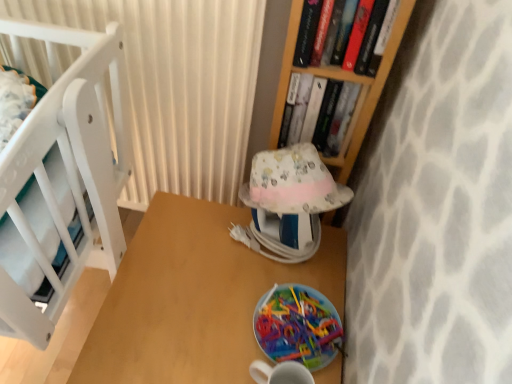
Describe the element at coordinates (177, 86) in the screenshot. I see `white textured curtain at upper left` at that location.

Where is `patterned fabric lampshade at center`? This screenshot has width=512, height=384. patterned fabric lampshade at center is located at coordinates (288, 202).

The height and width of the screenshot is (384, 512). Describe the element at coordinates (298, 326) in the screenshot. I see `translucent plastic plate at lower center` at that location.

I want to click on hardcover book at upper right, which appears as the 1th book when viewed from the front, so (365, 37).

Which point is more forward, (x=329, y=244) or (x=316, y=310)?

The point (x=316, y=310) is closer to the camera.

Locate an element on the screen. The height and width of the screenshot is (384, 512). table in front of the translucent plastic plate at lower center is located at coordinates (193, 298).

Is wooden table at center far from translucent plastic plate at lower center?

No.

From a real-world perspective, who is located higher, wooden table at center or translucent plastic plate at lower center?

From a 3D spatial view, translucent plastic plate at lower center is above.

Is patterned fabric lampshade at center located outside hardcover book at upper center, the first book positioned from the back?

Yes, patterned fabric lampshade at center is not within hardcover book at upper center, the first book positioned from the back.

Based on the photo, does patterned fabric lampshade at center lie in front of hardcover book at upper center, the first book positioned from the back?

That is True.

From a real-world perspective, is patterned fabric lampshade at center physically located above or below hardcover book at upper center, the first book positioned from the back?

patterned fabric lampshade at center is situated lower than hardcover book at upper center, the first book positioned from the back, in the real world.

Is patterned fabric lampshade at center not close to hardcover book at upper center, arranged as the 2th book when viewed from the front?

No, patterned fabric lampshade at center is not far from hardcover book at upper center, arranged as the 2th book when viewed from the front.

Is hardcover book at upper right, the second book in the back-to-front sequence, positioned with its back to patterned fabric lampshade at center?

That's not correct — hardcover book at upper right, the second book in the back-to-front sequence, is not looking away from patterned fabric lampshade at center.

This screenshot has height=384, width=512. What are the coordinates of `table lamp below the hardcover book at upper right, which appears as the 1th book when viewed from the front (from the image's perspective)` in the screenshot? It's located at (288, 202).

From the image's perspective, which is above, hardcover book at upper right, the second book in the back-to-front sequence, or patterned fabric lampshade at center?

hardcover book at upper right, the second book in the back-to-front sequence, is shown above in the image.

Is hardcover book at upper right, the second book in the back-to-front sequence, in front of or behind patterned fabric lampshade at center in the image?

In the image, hardcover book at upper right, the second book in the back-to-front sequence, appears in front of patterned fabric lampshade at center.

Does hardcover book at upper center, arranged as the 2th book when viewed from the front, have a greater width compared to wooden table at center?

No, hardcover book at upper center, arranged as the 2th book when viewed from the front, is not wider than wooden table at center.

Is hardcover book at upper center, the first book positioned from the back, in front of wooden table at center?

No, hardcover book at upper center, the first book positioned from the back, is further to the viewer.

How much distance is there between hardcover book at upper center, arranged as the 2th book when viewed from the front, and wooden table at center?

hardcover book at upper center, arranged as the 2th book when viewed from the front, and wooden table at center are 15.10 inches apart from each other.

How different are the orientations of hardcover book at upper center, arranged as the 2th book when viewed from the front, and wooden table at center in degrees?

hardcover book at upper center, arranged as the 2th book when viewed from the front, and wooden table at center are facing 85.5 degrees away from each other.

You are a GUI agent. You are given a task and a screenshot of the screen. Output one action in this format:
    pyautogui.click(x=<x>, y=<y>)
    Task: Click on the table below the translucent plastic plate at lower center (from the image's perspective)
    This screenshot has width=512, height=384.
    Given the screenshot: What is the action you would take?
    pyautogui.click(x=193, y=298)

From a real-world perspective, is translucent plastic plate at lower center over wooden table at center?

Yes, from a real-world perspective, translucent plastic plate at lower center is over wooden table at center

You are a GUI agent. You are given a task and a screenshot of the screen. Output one action in this format:
    pyautogui.click(x=<x>, y=<y>)
    Task: Click on the 1st book to the right when counting from the wooden table at center
    
    Given the screenshot: What is the action you would take?
    pyautogui.click(x=325, y=113)

Choose the correct answer: Is wooden table at center inside hardcover book at upper center, arranged as the 2th book when viewed from the front, or outside it?

wooden table at center is located beyond the bounds of hardcover book at upper center, arranged as the 2th book when viewed from the front.

Visually, is wooden table at center positioned to the left or to the right of hardcover book at upper center, arranged as the 2th book when viewed from the front?

In the image, wooden table at center appears on the left side of hardcover book at upper center, arranged as the 2th book when viewed from the front.

Can you confirm if wooden table at center is shorter than hardcover book at upper center, arranged as the 2th book when viewed from the front?

In fact, wooden table at center may be taller than hardcover book at upper center, arranged as the 2th book when viewed from the front.

Looking at this image, is hardcover book at upper center, the first book positioned from the back, taller or shorter than hardcover book at upper right, the second book in the back-to-front sequence?

hardcover book at upper center, the first book positioned from the back, is shorter than hardcover book at upper right, the second book in the back-to-front sequence.

I want to click on book on the right of the hardcover book at upper center, arranged as the 2th book when viewed from the front, so click(365, 37).

How different are the orientations of hardcover book at upper center, the first book positioned from the back, and hardcover book at upper right, which appears as the 1th book when viewed from the front, in degrees?

hardcover book at upper center, the first book positioned from the back, and hardcover book at upper right, which appears as the 1th book when viewed from the front, are facing 0.0033 degrees away from each other.

Is hardcover book at upper center, the first book positioned from the back, spatially inside hardcover book at upper right, which appears as the 1th book when viewed from the front, or outside of it?

hardcover book at upper center, the first book positioned from the back, exists outside the volume of hardcover book at upper right, which appears as the 1th book when viewed from the front.

Where is `plate on the right of wooden table at center`? This screenshot has height=384, width=512. plate on the right of wooden table at center is located at coordinates (298, 326).

The width and height of the screenshot is (512, 384). I want to click on table lamp beneath the hardcover book at upper center, the first book positioned from the back (from a real-world perspective), so click(x=288, y=202).

When comparing their distances from hardcover book at upper right, the second book in the back-to-front sequence, does patterned fabric lampshade at center or hardcover book at upper center, arranged as the 2th book when viewed from the front, seem further?

patterned fabric lampshade at center.

Looking at the image, which one is located further to wooden table at center, patterned fabric lampshade at center or hardcover book at upper center, arranged as the 2th book when viewed from the front?

hardcover book at upper center, arranged as the 2th book when viewed from the front, is further to wooden table at center.

Estimate the real-world distances between objects in this image. Which object is closer to wooden table at center, hardcover book at upper right, which appears as the 1th book when viewed from the front, or hardcover book at upper center, the first book positioned from the back?

hardcover book at upper center, the first book positioned from the back, is closer to wooden table at center.

Which object lies further to the anchor point translucent plastic plate at lower center, hardcover book at upper center, the first book positioned from the back, or wooden table at center?

Among the two, hardcover book at upper center, the first book positioned from the back, is located further to translucent plastic plate at lower center.

Which object lies further to the anchor point patterned fabric lampshade at center, hardcover book at upper right, the second book in the back-to-front sequence, or white textured curtain at upper left?

white textured curtain at upper left is positioned further to the anchor patterned fabric lampshade at center.

When comparing their distances from hardcover book at upper center, arranged as the 2th book when viewed from the front, does patterned fabric lampshade at center or translucent plastic plate at lower center seem further?

The object further to hardcover book at upper center, arranged as the 2th book when viewed from the front, is translucent plastic plate at lower center.

From the image, which object appears to be nearer to hardcover book at upper right, the second book in the back-to-front sequence, patterned fabric lampshade at center or white textured curtain at upper left?

Among the two, patterned fabric lampshade at center is located nearer to hardcover book at upper right, the second book in the back-to-front sequence.

When comparing their distances from translucent plastic plate at lower center, does hardcover book at upper center, the first book positioned from the back, or white textured curtain at upper left seem closer?

hardcover book at upper center, the first book positioned from the back, lies closer to translucent plastic plate at lower center than the other object.

I want to click on book between hardcover book at upper right, which appears as the 1th book when viewed from the front, and translucent plastic plate at lower center in the up-down direction, so click(325, 113).

Locate an element on the screen. The height and width of the screenshot is (384, 512). plate that lies between patterned fabric lampshade at center and wooden table at center from top to bottom is located at coordinates (298, 326).

You are a GUI agent. You are given a task and a screenshot of the screen. Output one action in this format:
    pyautogui.click(x=<x>, y=<y>)
    Task: Click on the book between white textured curtain at upper left and hardcover book at upper right, which appears as the 1th book when viewed from the front, from left to right
    
    Given the screenshot: What is the action you would take?
    pyautogui.click(x=325, y=113)

In order to click on table lamp between white textured curtain at upper left and wooden table at center vertically in this screenshot , I will do `click(288, 202)`.